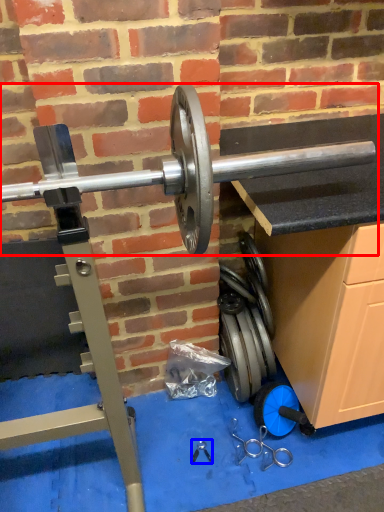
Question: Which object appears closest to the camera in this image, barbell (highlighted by a red box) or tool (highlighted by a blue box)?

Choices:
 (A) barbell
 (B) tool

Answer: (A)